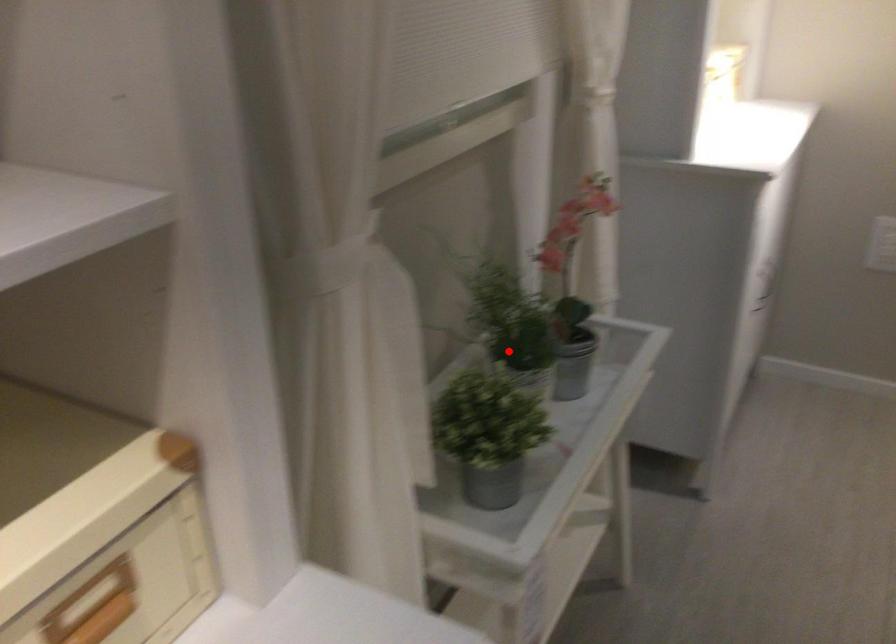
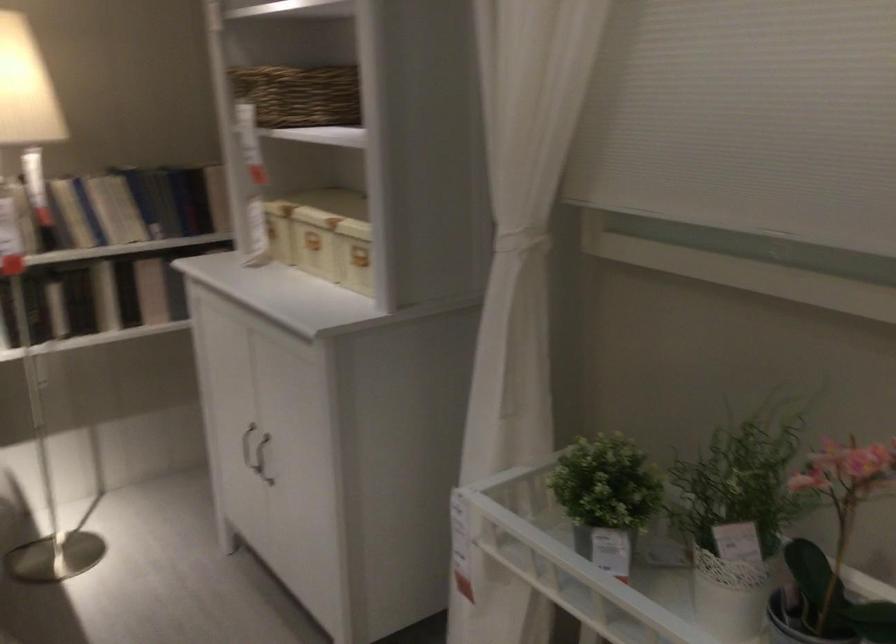
Locate, in the second image, the point that corresponds to the highlighted location in the first image.

(735, 518)